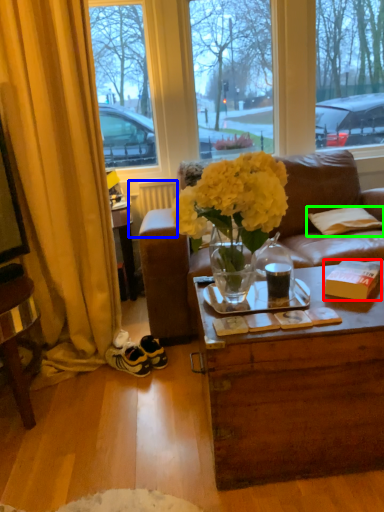
Question: Which is farther away from box (highlighted by a red box)? radiator (highlighted by a blue box) or pillow (highlighted by a green box)?

Choices:
 (A) radiator
 (B) pillow

Answer: (A)